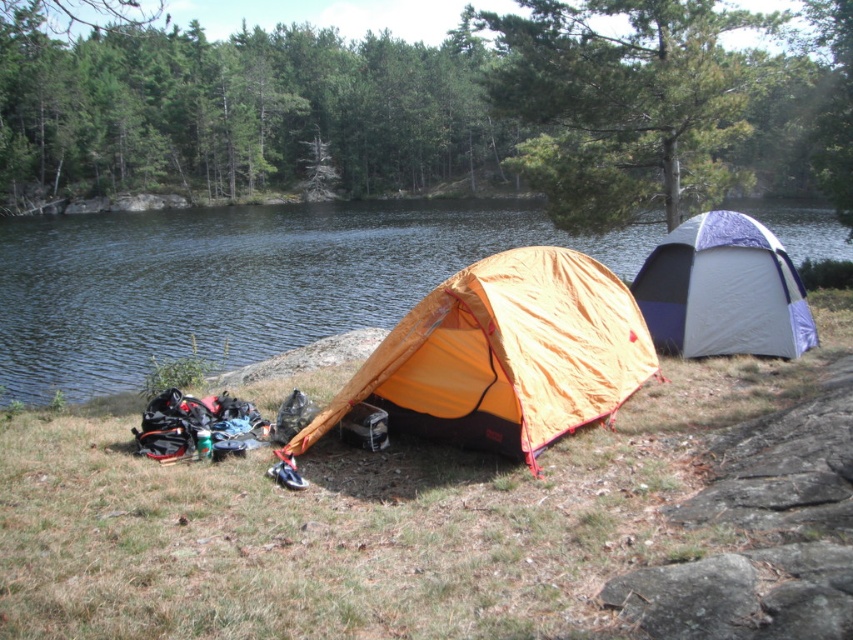
Question: Is orange nylon tent at center above white and purple fabric tent at right?

Choices:
 (A) yes
 (B) no

Answer: (B)

Question: Which point appears closest to the camera in this image?

Choices:
 (A) click(123, 316)
 (B) click(709, 336)

Answer: (B)

Question: Considering the real-world distances, which object is farthest from the orange nylon tent at center?

Choices:
 (A) white and purple fabric tent at right
 (B) transparent blue water at center

Answer: (B)

Question: Is orange nylon tent at center in front of white and purple fabric tent at right?

Choices:
 (A) no
 (B) yes

Answer: (B)

Question: Considering the relative positions of orange nylon tent at center and white and purple fabric tent at right in the image provided, where is orange nylon tent at center located with respect to white and purple fabric tent at right?

Choices:
 (A) left
 (B) right

Answer: (A)

Question: Which point appears farthest from the camera in this image?

Choices:
 (A) pos(422,253)
 (B) pos(637,374)
 (C) pos(728,324)

Answer: (A)